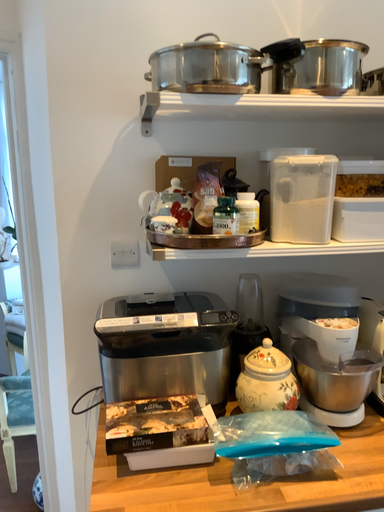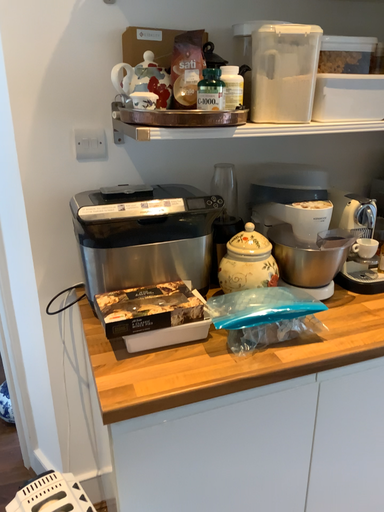
Question: How did the camera likely rotate when shooting the video?

Choices:
 (A) rotated upward
 (B) rotated downward

Answer: (B)